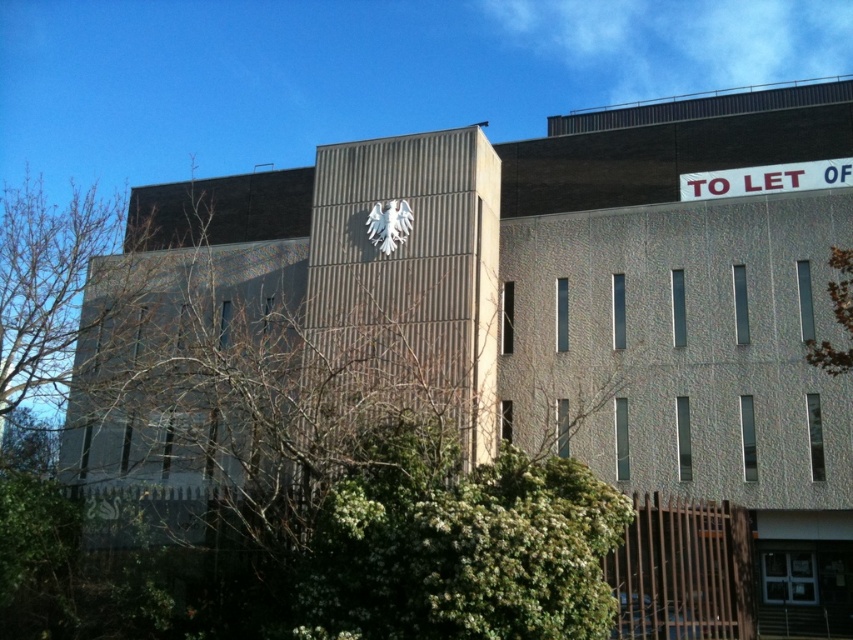
Is green leafy tree at right smaller than white matte eagle at upper center?

Incorrect, green leafy tree at right is not smaller in size than white matte eagle at upper center.

Between green leafy tree at right and white matte eagle at upper center, which one has more height?

green leafy tree at right

What do you see at coordinates (836, 317) in the screenshot? Image resolution: width=853 pixels, height=640 pixels. I see `green leafy tree at right` at bounding box center [836, 317].

Where is `green leafy tree at right`? This screenshot has width=853, height=640. green leafy tree at right is located at coordinates (836, 317).

Does green leafy tree at upper center appear under white matte eagle at upper center?

Yes.

Is point (604, 550) positioned in front of point (405, 228)?

Yes, it is in front of point (405, 228).

Locate an element on the screen. green leafy tree at upper center is located at coordinates (293, 483).

Between point (195, 355) and point (828, 340), which one is positioned behind?

Point (828, 340)

Find the location of `green leafy tree at upper center`. green leafy tree at upper center is located at coordinates (293, 483).